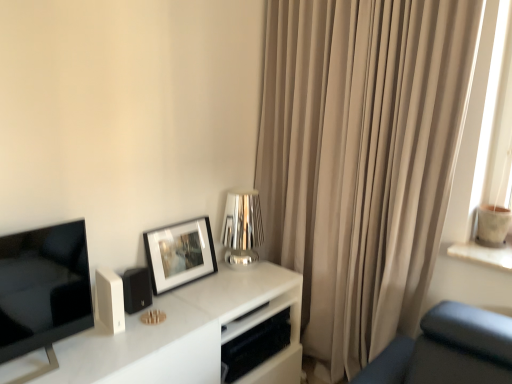
Find the location of a particular element. Image resolution: width=512 pixels, height=384 pixels. vacant location below black glossy television at left (from a real-world perspective) is located at coordinates (53, 363).